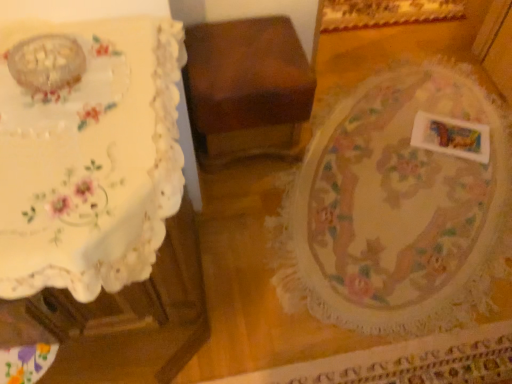
I want to click on empty space that is ontop of white lace tablecloth at left, so click(x=72, y=125).